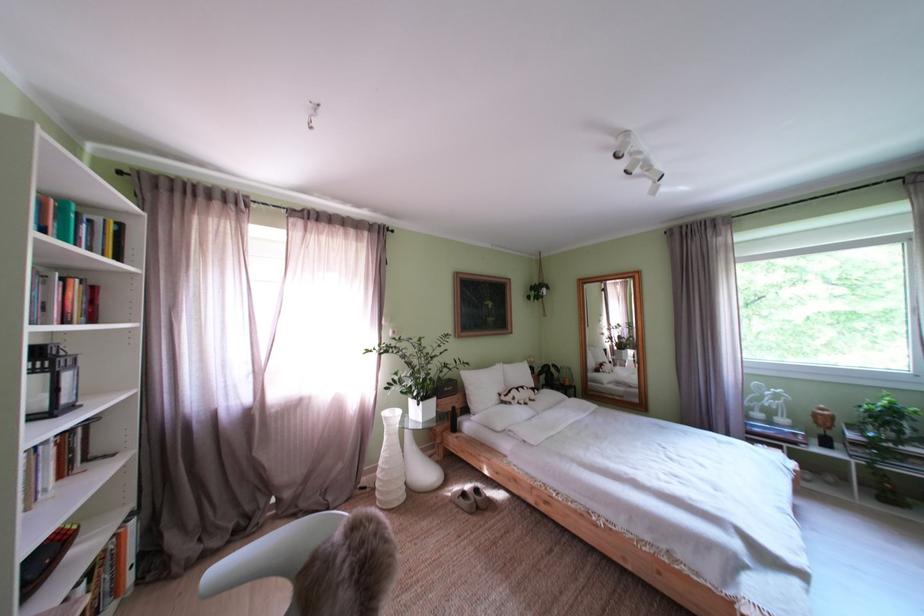
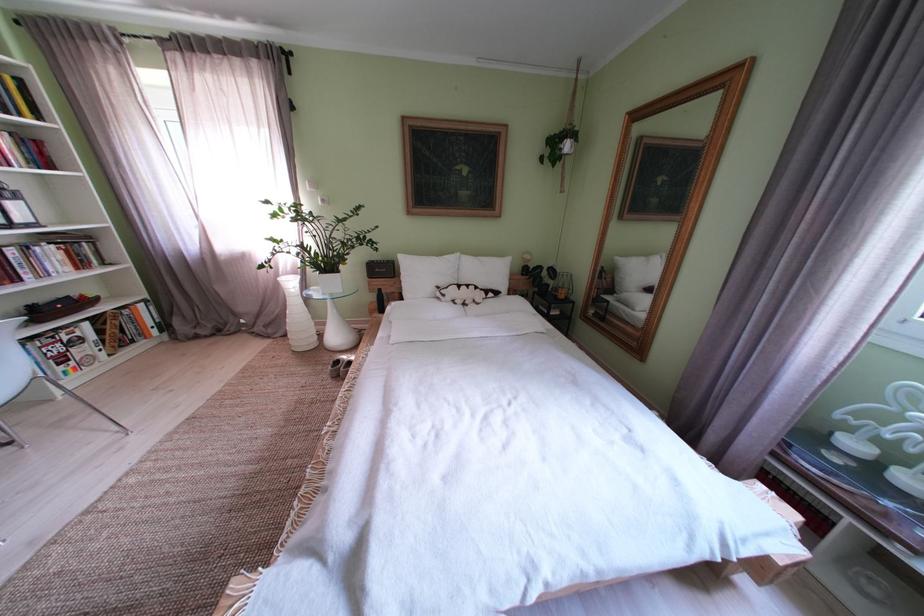
Locate, in the second image, the point that corresponds to pixel 475 500 in the first image.

(348, 367)